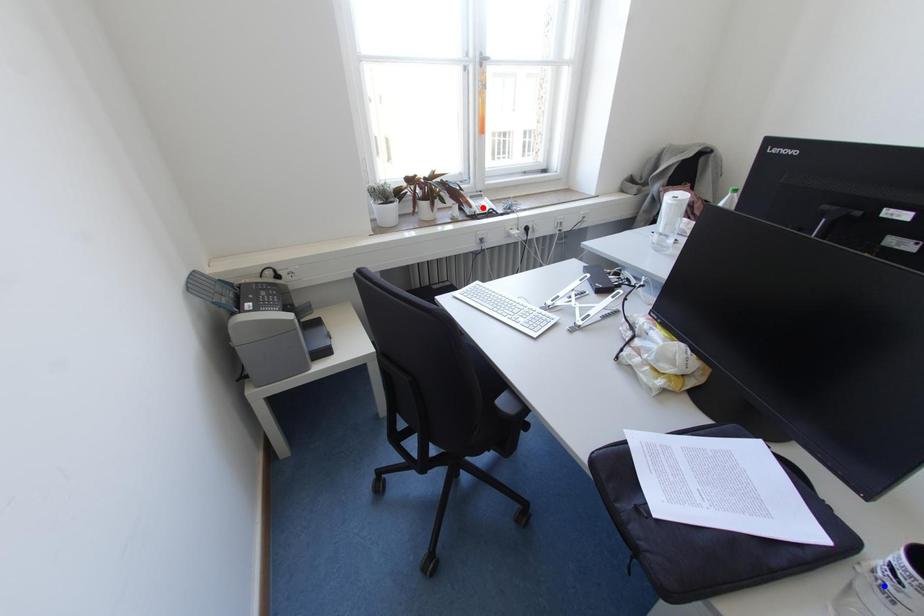
Question: Which of the two points in the image is closer to the camera?

Choices:
 (A) Blue point is closer.
 (B) Red point is closer.

Answer: (A)